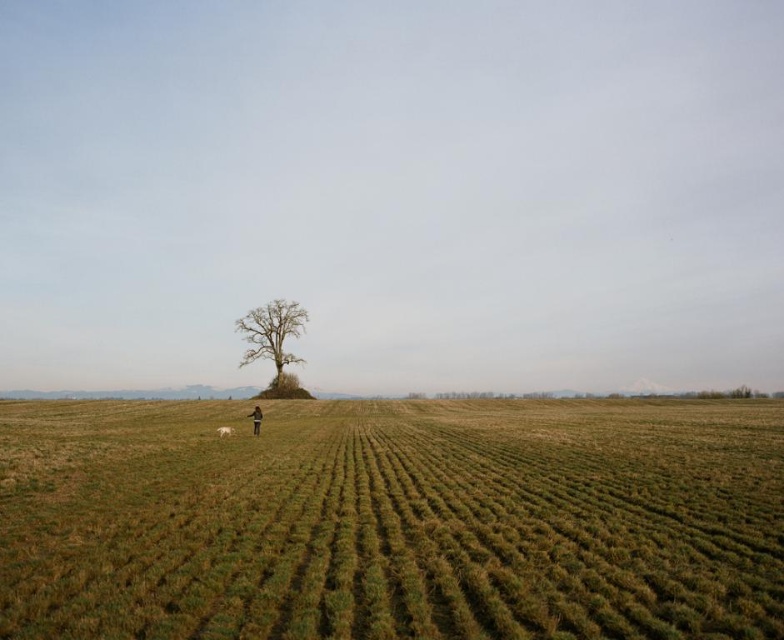
You are a farmer planning to plant a new row of crops between the green grassy field at center and the bare wood tree at center. Based on their widths, which area should you choose to ensure the row fits properly?

The green grassy field at center is wider than the bare wood tree at center, so you should plant the new row of crops in the area of the green grassy field at center to ensure it fits properly.

You are standing in the open field and want to place your dark brown leather jacket at lower center near the bare wood tree at center. Considering their widths, which object is wider?

The bare wood tree at center is wider than the dark brown leather jacket at lower center according to the description.

You are a photographer trying to capture the entire scene of the open field with the bare wood tree at center and the white fur dog at lower center. Which object will appear larger in your photo?

The bare wood tree at center will appear larger in the photo because it is bigger than the white fur dog at lower center.